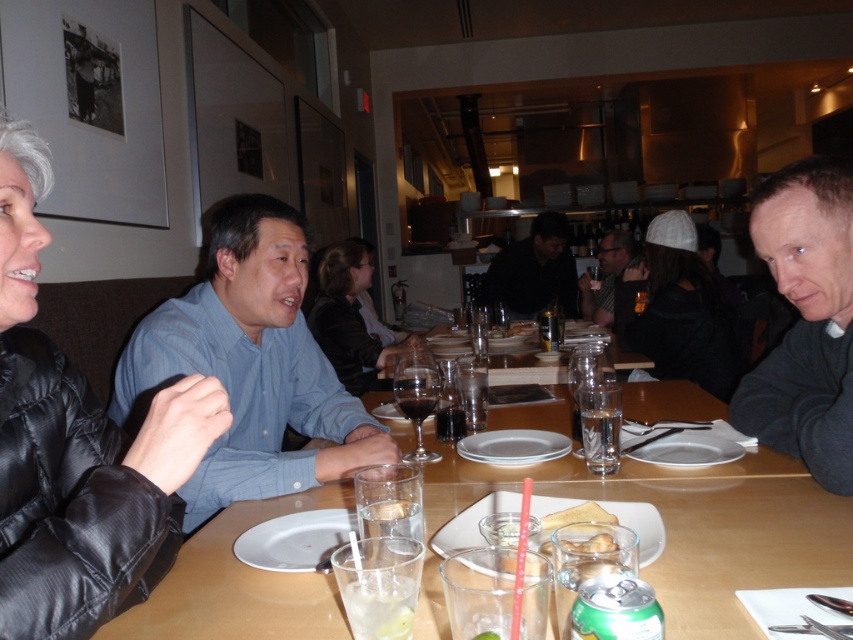
Who is shorter, dark gray sweater at center or clear glass water at table center?

Standing shorter between the two is clear glass water at table center.

Between dark gray sweater at center and clear glass water at table center, which one has more height?

Standing taller between the two is dark gray sweater at center.

Between point (339, 252) and point (598, 451), which one is positioned behind?

Point (339, 252)

Where is `dark gray sweater at center`? dark gray sweater at center is located at coordinates (346, 316).

Does point (350, 412) come behind point (555, 328)?

That is False.

Can you confirm if blue shirt at center is positioned below clear glass at table center?

Indeed, blue shirt at center is positioned under clear glass at table center.

Is point (289, 301) farther from viewer compared to point (540, 324)?

No.

Find the location of a particular element. The image size is (853, 640). blue shirt at center is located at coordinates (251, 365).

From the picture: Which is below, dark red liquid at center or translucent glass wine at table center?

Positioned lower is translucent glass wine at table center.

Which of these two, dark red liquid at center or translucent glass wine at table center, stands shorter?

translucent glass wine at table center

The width and height of the screenshot is (853, 640). What do you see at coordinates (415, 403) in the screenshot? I see `dark red liquid at center` at bounding box center [415, 403].

Locate an element on the screen. This screenshot has height=640, width=853. dark red liquid at center is located at coordinates (415, 403).